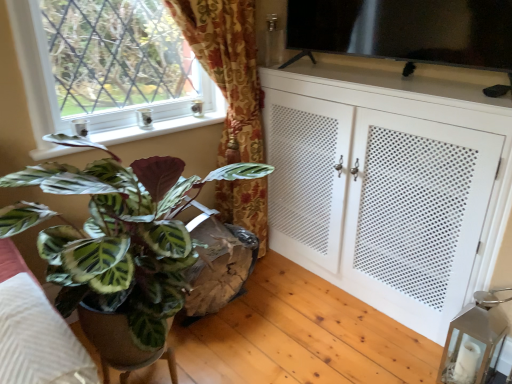
The width and height of the screenshot is (512, 384). What do you see at coordinates (475, 341) in the screenshot?
I see `metallic glass lantern at lower right` at bounding box center [475, 341].

Describe the element at coordinates (157, 129) in the screenshot. I see `white glossy window sill at upper left` at that location.

This screenshot has height=384, width=512. I want to click on transparent glass tv at upper right, so click(407, 30).

Which point is more distant from viewer, (377, 206) or (58, 316)?

The point (377, 206) is farther from the camera.

Does white perforated cabinet at right appear on the right side of green leafy plant at lower left?

Correct, you'll find white perforated cabinet at right to the right of green leafy plant at lower left.

Is white perforated cabinet at right aimed at green leafy plant at lower left?

Yes.

Considering the sizes of white glossy window sill at upper left and metallic glass lantern at lower right in the image, is white glossy window sill at upper left taller or shorter than metallic glass lantern at lower right?

white glossy window sill at upper left is shorter than metallic glass lantern at lower right.

Who is smaller, white glossy window sill at upper left or metallic glass lantern at lower right?

With smaller size is white glossy window sill at upper left.

Considering the positions of objects white glossy window sill at upper left and metallic glass lantern at lower right in the image provided, who is more to the left, white glossy window sill at upper left or metallic glass lantern at lower right?

From the viewer's perspective, white glossy window sill at upper left appears more on the left side.

Is white glossy window sill at upper left beside metallic glass lantern at lower right?

They are not placed beside each other.

In the scene shown: Is white perforated cabinet at right next to green marbled leaf at left and touching it?

They are not placed beside each other.

Is white perforated cabinet at right aimed at green marbled leaf at left?

Yes, white perforated cabinet at right is aimed at green marbled leaf at left.

Between white perforated cabinet at right and green marbled leaf at left, which one appears on the right side from the viewer's perspective?

From the viewer's perspective, white perforated cabinet at right appears more on the right side.

Between point (445, 250) and point (305, 11), which one is positioned behind?

The point (305, 11) is farther from the camera.

Does white perforated cabinet at right have a smaller size compared to transparent glass tv at upper right?

No.

In terms of height, does white perforated cabinet at right look taller or shorter compared to transparent glass tv at upper right?

white perforated cabinet at right is taller than transparent glass tv at upper right.

Would you say white perforated cabinet at right contains transparent glass tv at upper right?

No, transparent glass tv at upper right is located outside of white perforated cabinet at right.

Is transparent glass tv at upper right at the back of metallic glass lantern at lower right?

No.

Can you tell me how much metallic glass lantern at lower right and transparent glass tv at upper right differ in facing direction?

metallic glass lantern at lower right and transparent glass tv at upper right are facing 2.93 degrees away from each other.

Measure the distance between metallic glass lantern at lower right and transparent glass tv at upper right.

A distance of 3.31 feet exists between metallic glass lantern at lower right and transparent glass tv at upper right.

Would you consider metallic glass lantern at lower right to be distant from transparent glass tv at upper right?

metallic glass lantern at lower right is positioned a significant distance from transparent glass tv at upper right.

From a real-world perspective, relative to transparent glass tv at upper right, is white glossy window sill at upper left vertically above or below?

Clearly, from a real-world perspective, white glossy window sill at upper left is below transparent glass tv at upper right.

Is white glossy window sill at upper left oriented towards transparent glass tv at upper right?

No, white glossy window sill at upper left is not oriented towards transparent glass tv at upper right.

Which object is closer to the camera, white glossy window sill at upper left or transparent glass tv at upper right?

transparent glass tv at upper right is closer to the camera.

Choose the correct answer: Is metallic glass lantern at lower right inside green leafy plant at lower left or outside it?

metallic glass lantern at lower right is not inside green leafy plant at lower left, it's outside.

Between metallic glass lantern at lower right and green leafy plant at lower left, which one has larger width?

With larger width is green leafy plant at lower left.

Is metallic glass lantern at lower right touching green leafy plant at lower left?

No.

Image resolution: width=512 pixels, height=384 pixels. What are the coordinates of `cabinetry lying above the green leafy plant at lower left (from the image's perspective)` in the screenshot? It's located at (388, 186).

The width and height of the screenshot is (512, 384). In order to click on window sill located on the left of metallic glass lantern at lower right in this screenshot , I will do `click(157, 129)`.

When comparing their distances from white perforated cabinet at right, does white glossy window sill at upper left or metallic glass lantern at lower right seem further?

Among the two, white glossy window sill at upper left is located further to white perforated cabinet at right.

Based on their spatial positions, is white perforated cabinet at right or green leafy plant at lower left further from transparent glass tv at upper right?

The object further to transparent glass tv at upper right is green leafy plant at lower left.

Considering their positions, is green marbled leaf at left positioned further to transparent glass tv at upper right than white perforated cabinet at right?

The object further to transparent glass tv at upper right is green marbled leaf at left.

Considering their positions, is transparent glass tv at upper right positioned further to white perforated cabinet at right than green leafy plant at lower left?

green leafy plant at lower left lies further to white perforated cabinet at right than the other object.

Looking at this image, when comparing their distances from white perforated cabinet at right, does green marbled leaf at left or white glossy window sill at upper left seem closer?

white glossy window sill at upper left lies closer to white perforated cabinet at right than the other object.

Based on the photo, based on their spatial positions, is white glossy window sill at upper left or metallic glass lantern at lower right closer to green leafy plant at lower left?

white glossy window sill at upper left is closer to green leafy plant at lower left.

Consider the image. Considering their positions, is transparent glass tv at upper right positioned further to metallic glass lantern at lower right than green marbled leaf at left?

green marbled leaf at left.

Considering their positions, is green leafy plant at lower left positioned closer to white glossy window sill at upper left than white perforated cabinet at right?

green leafy plant at lower left.

You are a GUI agent. You are given a task and a screenshot of the screen. Output one action in this format:
    pyautogui.click(x=<x>, y=<y>)
    Task: Click on the bedding between white glossy window sill at upper left and metallic glass lantern at lower right
    
    Given the screenshot: What is the action you would take?
    pyautogui.click(x=35, y=331)

The width and height of the screenshot is (512, 384). What are the coordinates of `cabinetry between green marbled leaf at left and metallic glass lantern at lower right` in the screenshot? It's located at (388, 186).

Where is `cabinetry between green leafy plant at lower left and metallic glass lantern at lower right from left to right`? cabinetry between green leafy plant at lower left and metallic glass lantern at lower right from left to right is located at coordinates (388, 186).

The width and height of the screenshot is (512, 384). I want to click on window screen located between green marbled leaf at left and metallic glass lantern at lower right in the left-right direction, so click(x=407, y=30).